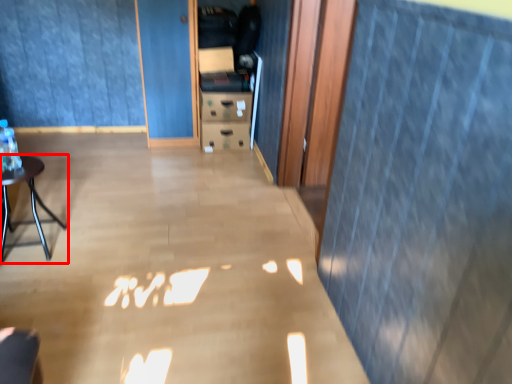
Question: Considering the relative positions of furniture (annotated by the red box) and curtain in the image provided, where is furniture (annotated by the red box) located with respect to the staircase?

Choices:
 (A) right
 (B) left

Answer: (B)